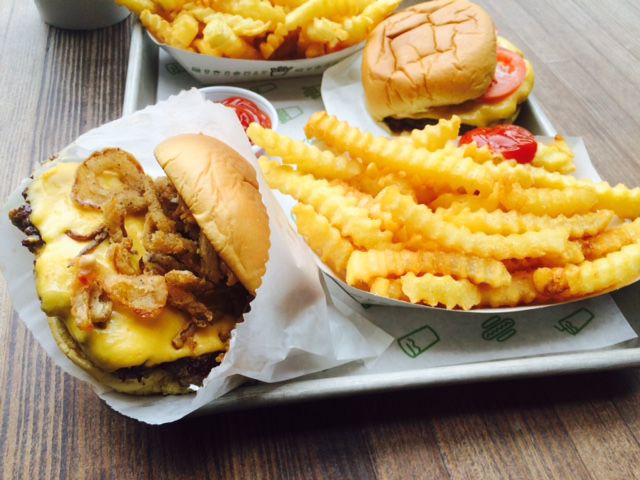
This screenshot has width=640, height=480. What are the coordinates of `table` in the screenshot? It's located at (35, 411).